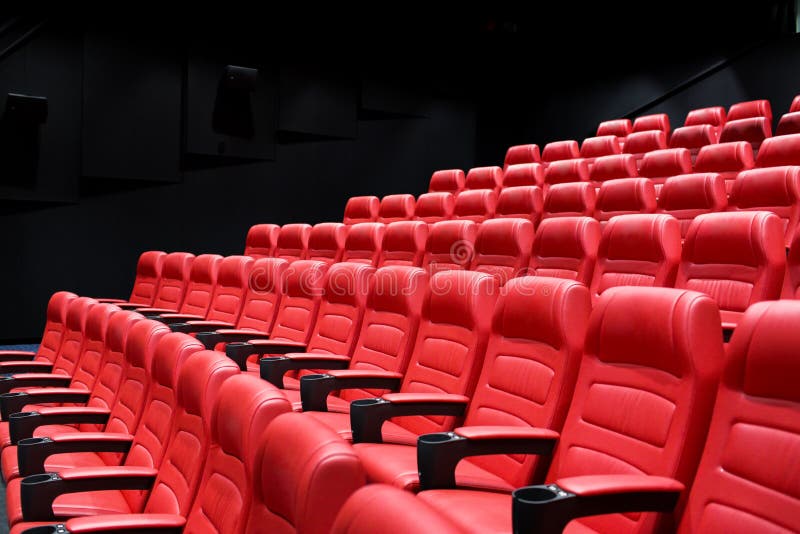
At what (x,y) coordinates should I click in order to perform the action: click on theater seat in fifth row. Please return your answer as a coordinate pair (x, y). Looking at the image, I should click on (778, 153), (712, 152), (652, 161), (610, 164), (570, 171), (521, 170), (480, 176), (448, 176).